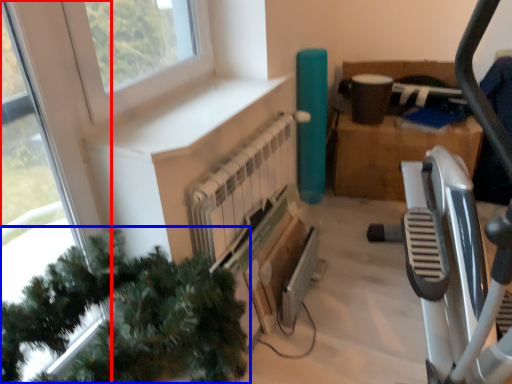
Question: Which object appears closest to the camera in this image, window (highlighted by a red box) or christmas tree (highlighted by a blue box)?

Choices:
 (A) window
 (B) christmas tree

Answer: (B)